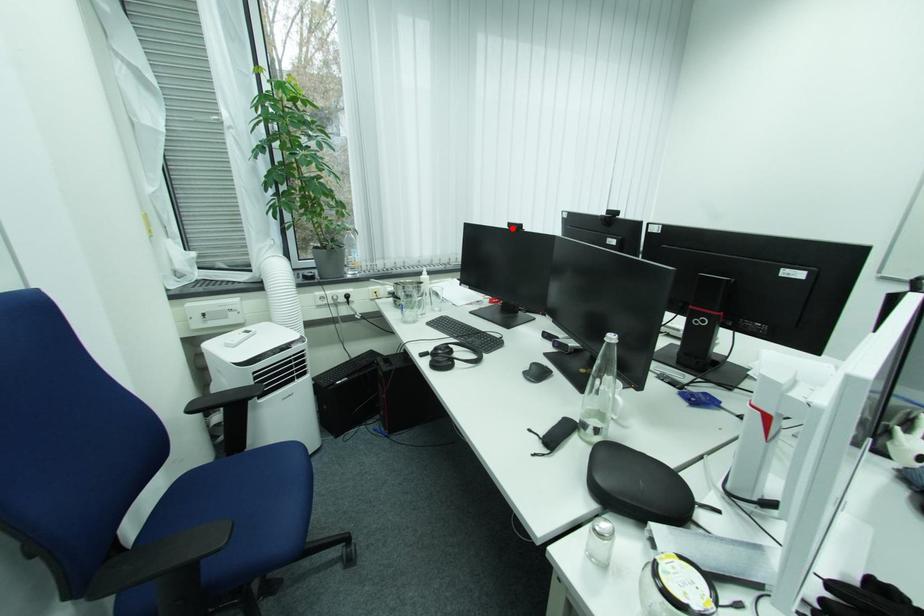
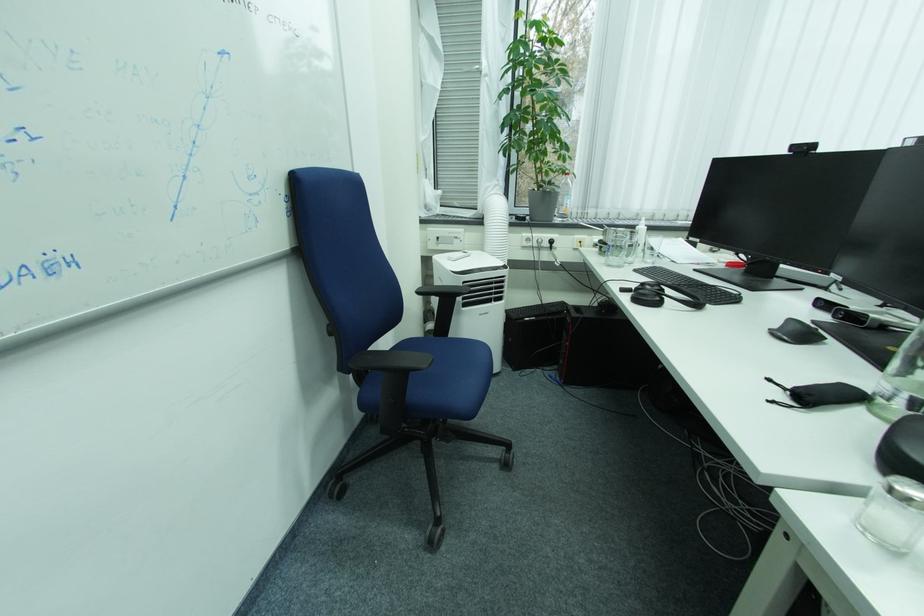
The point at the highlighted location is marked in the first image. Where is the corresponding point in the second image?

(792, 153)